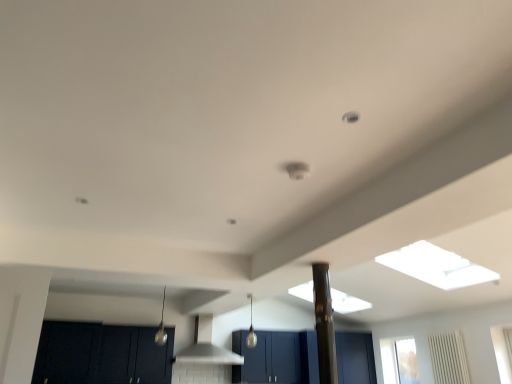
What is the approximate height of white matte vent at center?

white matte vent at center is 26.65 inches in height.

You are a GUI agent. You are given a task and a screenshot of the screen. Output one action in this format:
    pyautogui.click(x=<x>, y=<y>)
    Task: Click on the dark wood cabinet at lower left, the third cabinetry positioned from the right
    Image resolution: width=512 pixels, height=384 pixels.
    Given the screenshot: What is the action you would take?
    pyautogui.click(x=67, y=353)

The image size is (512, 384). What do you see at coordinates (277, 358) in the screenshot?
I see `matte blue cabinet at center, marked as the first cabinetry in a right-to-left arrangement` at bounding box center [277, 358].

In order to face black glossy pillar at center, should I rotate leftwards or rightwards?

It's best to rotate right around 8.997 degrees.

What is the approximate height of matte black cabinets at lower left, the second cabinetry positioned from the right?

It is 76.29 centimeters.

Locate an element on the screen. white matte vent at center is located at coordinates (206, 346).

Which cabinetry is the 2nd one when counting from the back of the dark wood cabinet at lower left, the third cabinetry positioned from the right? Please provide its 2D coordinates.

[(277, 358)]

Consider the image. From a real-world perspective, between dark wood cabinet at lower left, the first cabinetry positioned from the left, and matte blue cabinet at center, marked as the first cabinetry in a right-to-left arrangement, who is vertically lower?

matte blue cabinet at center, marked as the first cabinetry in a right-to-left arrangement.

Which is behind, dark wood cabinet at lower left, the first cabinetry positioned from the left, or matte blue cabinet at center, marked as the first cabinetry in a right-to-left arrangement?

matte blue cabinet at center, marked as the first cabinetry in a right-to-left arrangement, is further away from the camera.

Is matte black cabinets at lower left, the second cabinetry positioned from the right, inside the boundaries of black glossy pillar at center, or outside?

matte black cabinets at lower left, the second cabinetry positioned from the right, is outside black glossy pillar at center.

Which of these two, matte black cabinets at lower left, positioned as the 2th cabinetry in left-to-right order, or black glossy pillar at center, stands shorter?

Standing shorter between the two is matte black cabinets at lower left, positioned as the 2th cabinetry in left-to-right order.

Considering the relative positions of matte blue cabinet at center, positioned as the 3th cabinetry in left-to-right order, and black glossy pillar at center in the image provided, is matte blue cabinet at center, positioned as the 3th cabinetry in left-to-right order, to the right of black glossy pillar at center from the viewer's perspective?

Correct, you'll find matte blue cabinet at center, positioned as the 3th cabinetry in left-to-right order, to the right of black glossy pillar at center.

From the image's perspective, would you say matte blue cabinet at center, marked as the first cabinetry in a right-to-left arrangement, is shown under black glossy pillar at center?

Yes, from the image's perspective, matte blue cabinet at center, marked as the first cabinetry in a right-to-left arrangement, is below black glossy pillar at center.

Which is correct: matte blue cabinet at center, positioned as the 3th cabinetry in left-to-right order, is inside black glossy pillar at center, or outside of it?

matte blue cabinet at center, positioned as the 3th cabinetry in left-to-right order, is not enclosed by black glossy pillar at center.

Which of these two, white matte vent at center or black glossy pillar at center, stands taller?

With more height is black glossy pillar at center.

Who is bigger, white matte vent at center or black glossy pillar at center?

white matte vent at center is bigger.

From the image's perspective, between white matte vent at center and black glossy pillar at center, who is located below?

white matte vent at center.

Is white matte vent at center at the left side of black glossy pillar at center?

Correct, you'll find white matte vent at center to the left of black glossy pillar at center.

Is point (336, 345) positioned before point (202, 315)?

No.

Is matte blue cabinet at center, marked as the first cabinetry in a right-to-left arrangement, inside or outside of white matte vent at center?

matte blue cabinet at center, marked as the first cabinetry in a right-to-left arrangement, is outside white matte vent at center.

Is matte blue cabinet at center, positioned as the 3th cabinetry in left-to-right order, oriented away from white matte vent at center?

No, matte blue cabinet at center, positioned as the 3th cabinetry in left-to-right order, is not facing the opposite direction of white matte vent at center.

From the picture: Is there a large distance between matte blue cabinet at center, positioned as the 3th cabinetry in left-to-right order, and white matte vent at center?

No, matte blue cabinet at center, positioned as the 3th cabinetry in left-to-right order, is not far away from white matte vent at center.

From a real-world perspective, is dark wood cabinet at lower left, the third cabinetry positioned from the right, physically below white matte vent at center?

Yes, from a real-world perspective, dark wood cabinet at lower left, the third cabinetry positioned from the right, is beneath white matte vent at center.

Is white matte vent at center located within dark wood cabinet at lower left, the first cabinetry positioned from the left?

Actually, white matte vent at center is outside dark wood cabinet at lower left, the first cabinetry positioned from the left.

What's the angular difference between dark wood cabinet at lower left, the first cabinetry positioned from the left, and white matte vent at center's facing directions?

0.0345 degrees.

From the image's perspective, is dark wood cabinet at lower left, the first cabinetry positioned from the left, positioned above or below white matte vent at center?

Based on their image positions, dark wood cabinet at lower left, the first cabinetry positioned from the left, is located above white matte vent at center.

Is the depth of white matte vent at center less than that of dark wood cabinet at lower left, the first cabinetry positioned from the left?

No, white matte vent at center is behind dark wood cabinet at lower left, the first cabinetry positioned from the left.

Which is more to the left, white matte vent at center or dark wood cabinet at lower left, the third cabinetry positioned from the right?

dark wood cabinet at lower left, the third cabinetry positioned from the right, is more to the left.

Which object is thinner, white matte vent at center or dark wood cabinet at lower left, the first cabinetry positioned from the left?

white matte vent at center is thinner.

Is white matte vent at center completely or partially outside of dark wood cabinet at lower left, the third cabinetry positioned from the right?

Indeed, white matte vent at center is completely outside dark wood cabinet at lower left, the third cabinetry positioned from the right.

Locate an element on the screen. This screenshot has width=512, height=384. the 2nd cabinetry to the right when counting from the dark wood cabinet at lower left, the first cabinetry positioned from the left is located at coordinates (277, 358).

The image size is (512, 384). In order to click on cabinetry that is the 2nd one below the black glossy pillar at center (from a real-world perspective) in this screenshot , I will do `click(102, 354)`.

In the scene shown: Based on their spatial positions, is black glossy pillar at center or dark wood cabinet at lower left, the third cabinetry positioned from the right, further from matte black cabinets at lower left, the second cabinetry positioned from the right?

Among the two, black glossy pillar at center is located further to matte black cabinets at lower left, the second cabinetry positioned from the right.

Based on their spatial positions, is matte black cabinets at lower left, positioned as the 2th cabinetry in left-to-right order, or black glossy pillar at center further from dark wood cabinet at lower left, the third cabinetry positioned from the right?

black glossy pillar at center lies further to dark wood cabinet at lower left, the third cabinetry positioned from the right, than the other object.

From the image, which object appears to be nearer to matte blue cabinet at center, marked as the first cabinetry in a right-to-left arrangement, dark wood cabinet at lower left, the first cabinetry positioned from the left, or white matte vent at center?

Among the two, white matte vent at center is located nearer to matte blue cabinet at center, marked as the first cabinetry in a right-to-left arrangement.

From the image, which object appears to be nearer to matte black cabinets at lower left, positioned as the 2th cabinetry in left-to-right order, matte blue cabinet at center, positioned as the 3th cabinetry in left-to-right order, or black glossy pillar at center?

matte blue cabinet at center, positioned as the 3th cabinetry in left-to-right order, lies closer to matte black cabinets at lower left, positioned as the 2th cabinetry in left-to-right order, than the other object.

Estimate the real-world distances between objects in this image. Which object is closer to matte blue cabinet at center, marked as the first cabinetry in a right-to-left arrangement, matte black cabinets at lower left, the second cabinetry positioned from the right, or white matte vent at center?

The object closer to matte blue cabinet at center, marked as the first cabinetry in a right-to-left arrangement, is white matte vent at center.

Based on their spatial positions, is dark wood cabinet at lower left, the third cabinetry positioned from the right, or matte black cabinets at lower left, the second cabinetry positioned from the right, closer to matte blue cabinet at center, marked as the first cabinetry in a right-to-left arrangement?

Based on the image, matte black cabinets at lower left, the second cabinetry positioned from the right, appears to be nearer to matte blue cabinet at center, marked as the first cabinetry in a right-to-left arrangement.

Which object lies nearer to the anchor point matte blue cabinet at center, marked as the first cabinetry in a right-to-left arrangement, black glossy pillar at center or white matte vent at center?

white matte vent at center lies closer to matte blue cabinet at center, marked as the first cabinetry in a right-to-left arrangement, than the other object.

Based on their spatial positions, is matte blue cabinet at center, marked as the first cabinetry in a right-to-left arrangement, or white matte vent at center closer to black glossy pillar at center?

Among the two, matte blue cabinet at center, marked as the first cabinetry in a right-to-left arrangement, is located nearer to black glossy pillar at center.

Where is `vent between dark wood cabinet at lower left, the first cabinetry positioned from the left, and matte blue cabinet at center, marked as the first cabinetry in a right-to-left arrangement`? This screenshot has height=384, width=512. vent between dark wood cabinet at lower left, the first cabinetry positioned from the left, and matte blue cabinet at center, marked as the first cabinetry in a right-to-left arrangement is located at coordinates (206, 346).

This screenshot has height=384, width=512. I want to click on vent between matte black cabinets at lower left, the second cabinetry positioned from the right, and matte blue cabinet at center, positioned as the 3th cabinetry in left-to-right order, in the horizontal direction, so [206, 346].

Image resolution: width=512 pixels, height=384 pixels. What are the coordinates of `cabinetry between dark wood cabinet at lower left, the third cabinetry positioned from the right, and matte blue cabinet at center, positioned as the 3th cabinetry in left-to-right order, in the horizontal direction` in the screenshot? It's located at (102, 354).

Image resolution: width=512 pixels, height=384 pixels. What are the coordinates of `cabinetry between dark wood cabinet at lower left, the first cabinetry positioned from the left, and white matte vent at center` in the screenshot? It's located at (102, 354).